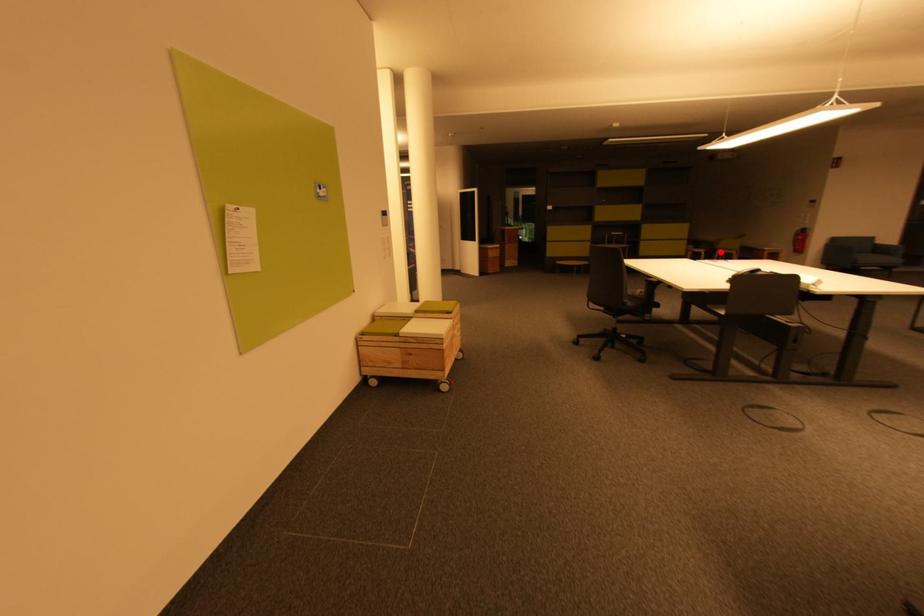
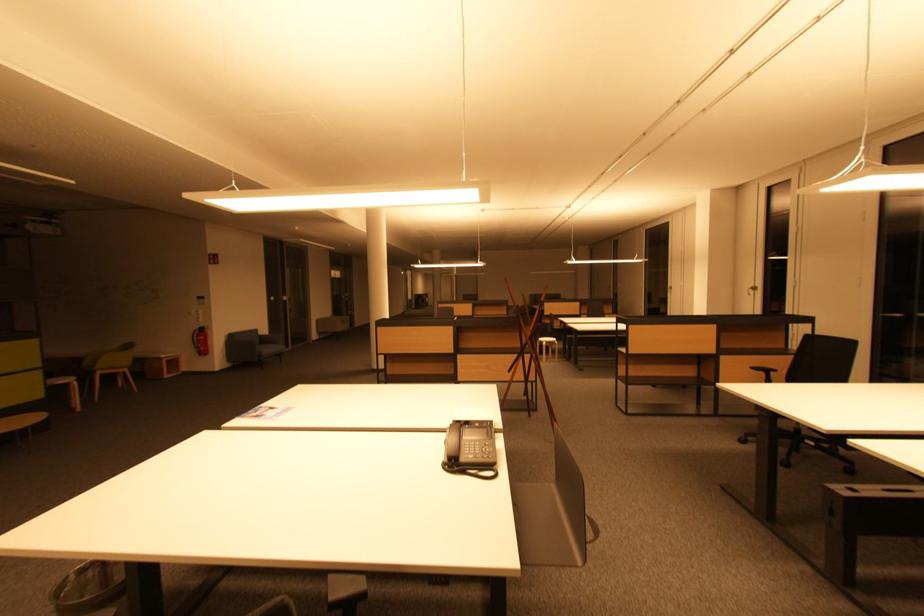
Find the pixel in the second image that matches the highlighted location in the first image.

(98, 374)